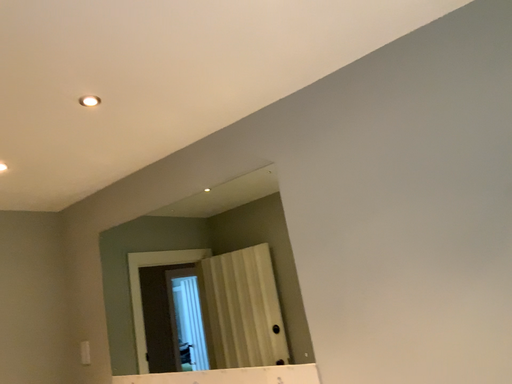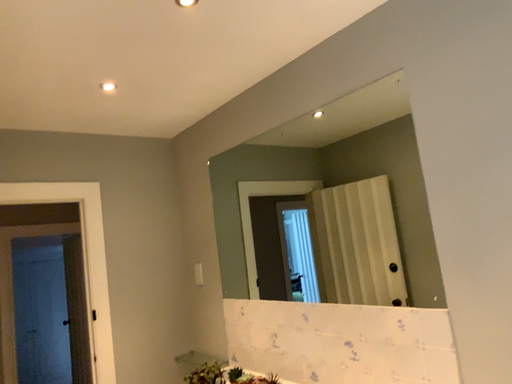
Question: Which way did the camera rotate in the video?

Choices:
 (A) rotated upward
 (B) rotated downward

Answer: (B)